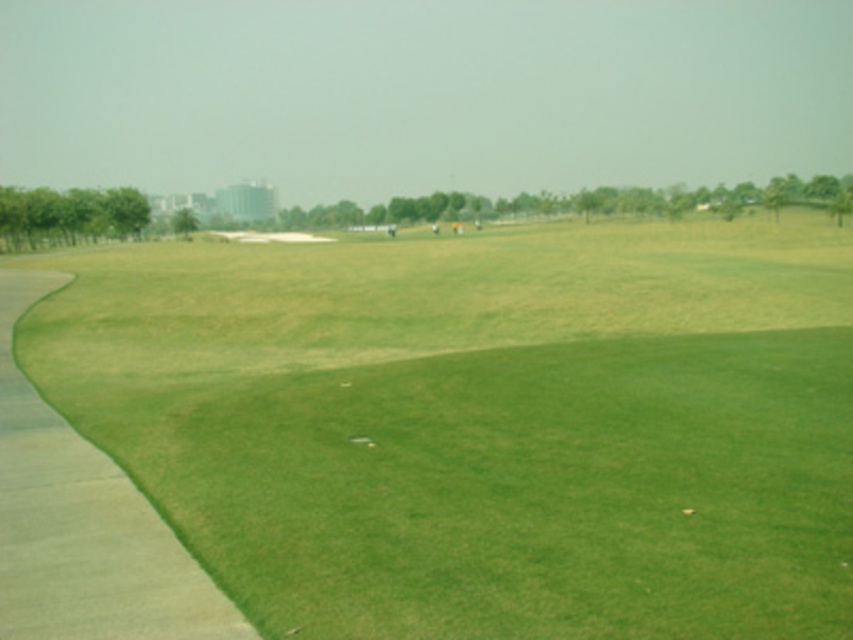
You are a golfer trying to determine the best path for your ball. You notice two areas of green grass at center and green grass at left. Which area is larger in size?

The green grass at center has a larger size compared to the green grass at left, so the area at center is larger.

You are a golfer standing on the fairway of the golf course. You notice two patches of green grass at center and green grass at left. Which one is positioned higher in the image?

The green grass at center is positioned higher in the image than the green grass at left.

You are a golfer standing on the green grass at center. You want to hit a ball to the green grass at left. The golf course has a rule that you must stay within 20 meters from your target area. Can you safely hit the ball without violating the rule?

→ The green grass at center and green grass at left are 20.25 meters apart from each other. Since the rule requires staying within 20 meters, the distance exceeds the limit by 0.25 meters, so you cannot safely hit the ball without violating the rule.